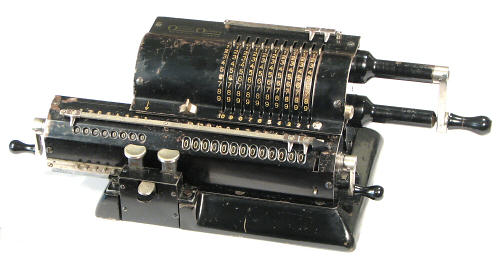
You are a GUI agent. You are given a task and a screenshot of the screen. Output one action in this format:
    pyautogui.click(x=<x>, y=<y>)
    Task: Click on the handle
    
    Given the screenshot: What is the action you would take?
    (x=11, y=145), (x=375, y=193), (x=481, y=123)